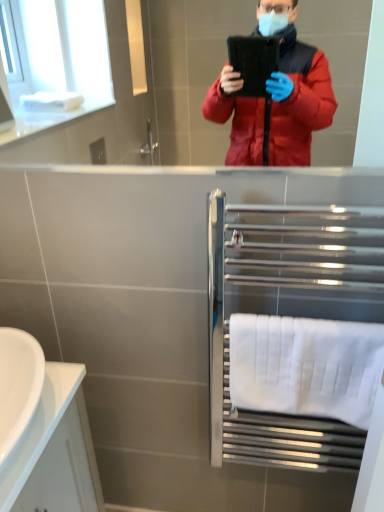
Describe the element at coordinates (287, 315) in the screenshot. The height and width of the screenshot is (512, 384). I see `polished chrome towel rack at lower right` at that location.

This screenshot has width=384, height=512. What do you see at coordinates (28, 405) in the screenshot? I see `white glossy sink at lower left` at bounding box center [28, 405].

This screenshot has width=384, height=512. I want to click on white cotton towel at lower right, so (305, 366).

Choose the correct answer: Is polished chrome towel rack at lower right inside white glossy sink at lower left or outside it?

The correct answer is: outside.

Is polished chrome towel rack at lower right placed right next to white glossy sink at lower left?

No, polished chrome towel rack at lower right is not in contact with white glossy sink at lower left.

How distant is polished chrome towel rack at lower right from white glossy sink at lower left?

polished chrome towel rack at lower right and white glossy sink at lower left are 19.86 inches apart.

Is polished chrome towel rack at lower right to the right of white glossy sink at lower left from the viewer's perspective?

Correct, you'll find polished chrome towel rack at lower right to the right of white glossy sink at lower left.

Considering the relative sizes of white glossy sink at lower left and polished chrome towel rack at lower right in the image provided, is white glossy sink at lower left shorter than polished chrome towel rack at lower right?

Yes.

Considering the relative sizes of white glossy sink at lower left and polished chrome towel rack at lower right in the image provided, is white glossy sink at lower left bigger than polished chrome towel rack at lower right?

Actually, white glossy sink at lower left might be smaller than polished chrome towel rack at lower right.

Which point is more distant from viewer, (9, 503) or (297, 295)?

The point (297, 295) is farther.

Is polished chrome towel rack at lower right completely or partially outside of white cotton towel at lower right?

Yes.

Does polished chrome towel rack at lower right have a greater height compared to white cotton towel at lower right?

Correct, polished chrome towel rack at lower right is much taller as white cotton towel at lower right.

Can you see polished chrome towel rack at lower right touching white cotton towel at lower right?

polished chrome towel rack at lower right and white cotton towel at lower right are not in contact.

Is point (213, 252) positioned before point (357, 422)?

No, (213, 252) is behind (357, 422).

Considering the relative sizes of white cotton towel at lower right and polished chrome towel rack at lower right in the image provided, is white cotton towel at lower right shorter than polished chrome towel rack at lower right?

→ Correct, white cotton towel at lower right is not as tall as polished chrome towel rack at lower right.

Is white cotton towel at lower right closer to camera compared to polished chrome towel rack at lower right?

No, the depth of white cotton towel at lower right is greater than that of polished chrome towel rack at lower right.

Which of these two, white cotton towel at lower right or polished chrome towel rack at lower right, is wider?

Wider between the two is polished chrome towel rack at lower right.

Is white cotton towel at lower right aimed at polished chrome towel rack at lower right?

Yes, white cotton towel at lower right is aimed at polished chrome towel rack at lower right.

Is point (275, 354) closer or farther from the camera than point (23, 402)?

Clearly, point (275, 354) is more distant from the camera than point (23, 402).

Who is taller, white cotton towel at lower right or white glossy sink at lower left?

With more height is white cotton towel at lower right.

This screenshot has width=384, height=512. Identify the location of sink that appears in front of the white cotton towel at lower right. (28, 405).

Consider the image. Is white cotton towel at lower right not within white glossy sink at lower left?

Yes, white cotton towel at lower right is outside of white glossy sink at lower left.

Is white cotton towel at lower right at the back of white glossy sink at lower left?

That's not correct — white glossy sink at lower left is not looking away from white cotton towel at lower right.

Is point (7, 475) less distant than point (272, 356)?

Yes, point (7, 475) is in front of point (272, 356).

Can you confirm if white glossy sink at lower left is thinner than white cotton towel at lower right?

No, white glossy sink at lower left is not thinner than white cotton towel at lower right.

Can you confirm if white glossy sink at lower left is taller than white cotton towel at lower right?

No, white glossy sink at lower left is not taller than white cotton towel at lower right.

This screenshot has height=512, width=384. Find the location of `balustrade below the white glossy sink at lower left (from a real-world perspective)`. balustrade below the white glossy sink at lower left (from a real-world perspective) is located at coordinates (287, 315).

Where is `balustrade above the white glossy sink at lower left (from the image's perspective)`? balustrade above the white glossy sink at lower left (from the image's perspective) is located at coordinates (287, 315).

Estimate the real-world distances between objects in this image. Which object is closer to polished chrome towel rack at lower right, white cotton towel at lower right or white glossy sink at lower left?

white cotton towel at lower right is closer to polished chrome towel rack at lower right.

Looking at the image, which one is located closer to white cotton towel at lower right, polished chrome towel rack at lower right or white glossy sink at lower left?

polished chrome towel rack at lower right lies closer to white cotton towel at lower right than the other object.

When comparing their distances from white cotton towel at lower right, does white glossy sink at lower left or polished chrome towel rack at lower right seem further?

Based on the image, white glossy sink at lower left appears to be further to white cotton towel at lower right.

Estimate the real-world distances between objects in this image. Which object is further from polished chrome towel rack at lower right, white glossy sink at lower left or white cotton towel at lower right?

The object further to polished chrome towel rack at lower right is white glossy sink at lower left.

Looking at the image, which one is located closer to white glossy sink at lower left, polished chrome towel rack at lower right or white cotton towel at lower right?

Based on the image, polished chrome towel rack at lower right appears to be nearer to white glossy sink at lower left.

Looking at the image, which one is located closer to white glossy sink at lower left, white cotton towel at lower right or polished chrome towel rack at lower right?

polished chrome towel rack at lower right lies closer to white glossy sink at lower left than the other object.

The width and height of the screenshot is (384, 512). I want to click on balustrade located between white glossy sink at lower left and white cotton towel at lower right in the left-right direction, so click(287, 315).